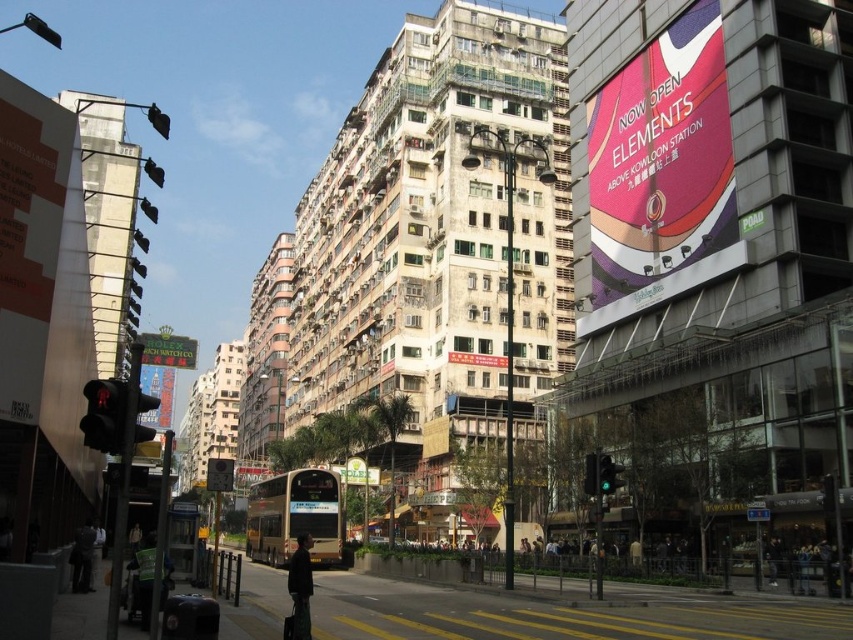
Question: Which of the following is the farthest from the observer?

Choices:
 (A) metallic gold sign at left
 (B) gold metallic bus at center
 (C) metallic silver sign at center

Answer: (B)

Question: Can you confirm if orange matte sign at left is positioned to the right of metallic gold rolex sign at left?

Choices:
 (A) yes
 (B) no

Answer: (A)

Question: Can you confirm if metallic gold rolex sign at left is positioned below green glass traffic light at center?

Choices:
 (A) no
 (B) yes

Answer: (A)

Question: Can you confirm if orange matte sign at left is positioned below red glossy signboard at center?

Choices:
 (A) no
 (B) yes

Answer: (A)

Question: Which object is positioned closest to the orange matte sign at left?

Choices:
 (A) matte black traffic light at left
 (B) matte pink signboard at upper right
 (C) gold metallic bus at center
 (D) metallic silver sign at center

Answer: (A)

Question: Which point appears farthest from the camera in this image?

Choices:
 (A) (311, 512)
 (B) (213, 472)
 (C) (119, 428)

Answer: (A)